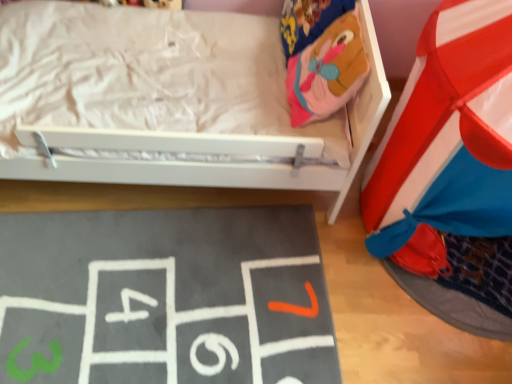
Locate an element on the screen. The width and height of the screenshot is (512, 384). free space above gray felt hopscotch at lower left (from a real-world perspective) is located at coordinates (162, 297).